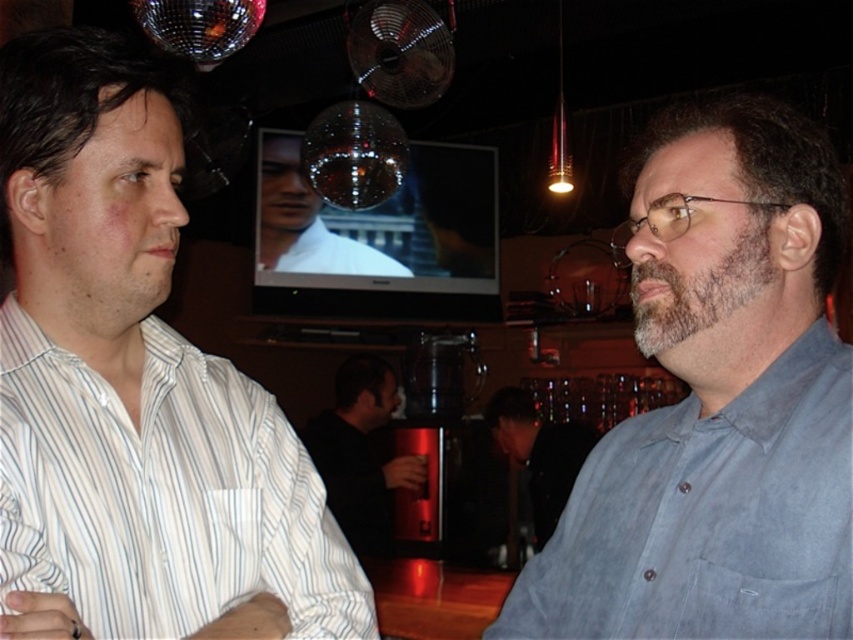
What is the exact coordinate of the white matte shirt at center?

The white matte shirt at center is located at point (305, 221).

You are a fashion designer observing two men in a bar. You notice the white matte shirt at center and the dark gray shirt at center. Which shirt would you recommend to a client who wants a more subtle and less attention grabbing outfit?

The white matte shirt at center has a smaller size compared to dark gray shirt at center, so it would be more subtle and less attention grabbing.